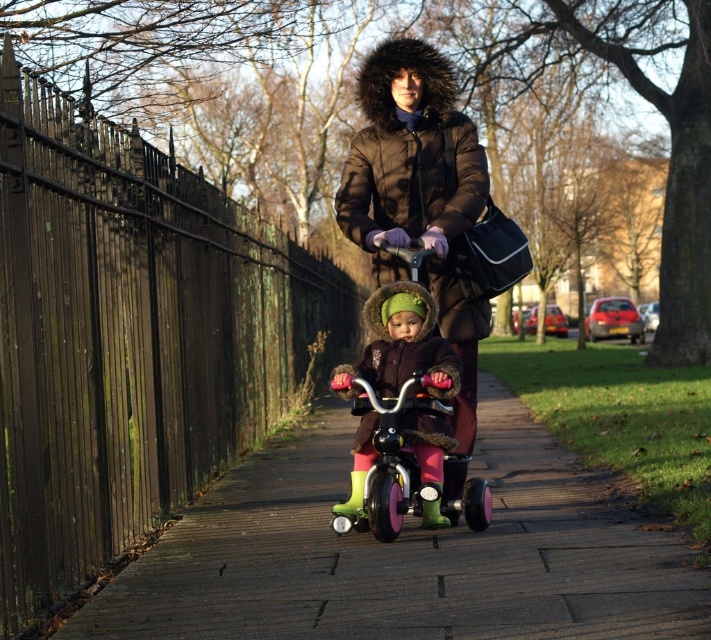
You are a parent watching your child play on the paved pathway. You see the dark brown quilted jacket at center and the matte pink tricycle at center. Which object is closer to you?

The dark brown quilted jacket at center is closer to you because the matte pink tricycle at center is behind it.

You are a parent watching your child riding the matte pink tricycle at center. You want to ensure the child stays safe from the dark brown wooden fence at left. Based on the scene, is the fence positioned in a way that the child could potentially collide with it while riding?

The dark brown wooden fence at left is in front of the matte pink tricycle at center, meaning the fence is closer to the child. This positioning increases the risk of collision if the child continues moving forward on the matte pink tricycle at center.